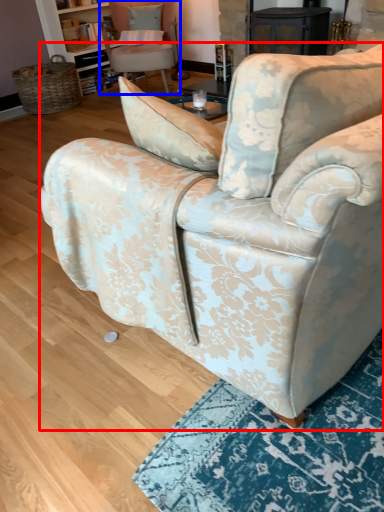
Question: Which of the following is the farthest to the observer, chair (highlighted by a red box) or chair (highlighted by a blue box)?

Choices:
 (A) chair
 (B) chair

Answer: (B)